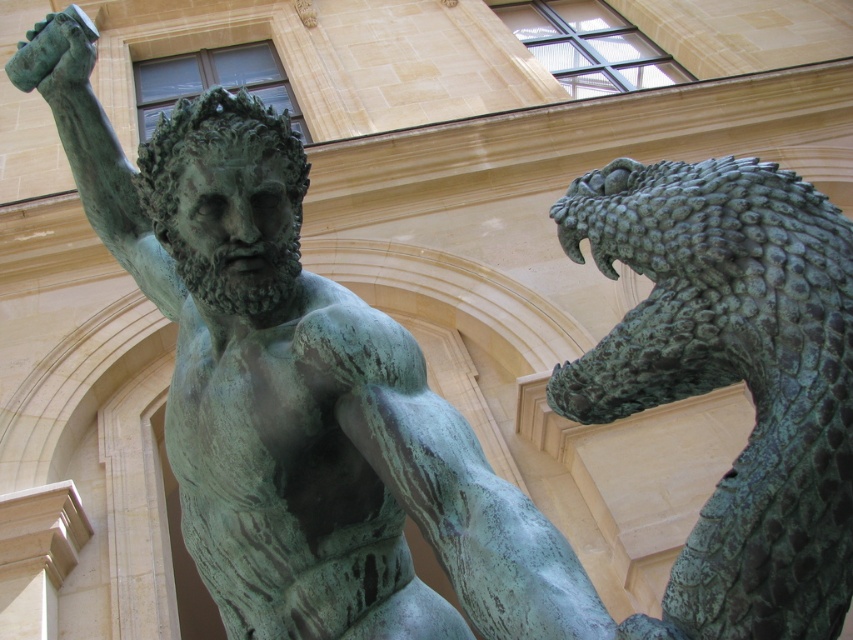
Question: Which point is closer to the camera?

Choices:
 (A) (207, 122)
 (B) (637, 209)

Answer: (B)

Question: Which point is closer to the camera taking this photo?

Choices:
 (A) (791, 196)
 (B) (363, 388)

Answer: (A)

Question: Does green patina statue at center have a lesser width compared to green patina scales at upper right?

Choices:
 (A) yes
 (B) no

Answer: (B)

Question: Considering the relative positions of green patina statue at center and green patina scales at upper right in the image provided, where is green patina statue at center located with respect to green patina scales at upper right?

Choices:
 (A) above
 (B) below

Answer: (A)

Question: Can you confirm if green patina statue at center is wider than green patina scales at upper right?

Choices:
 (A) no
 (B) yes

Answer: (B)